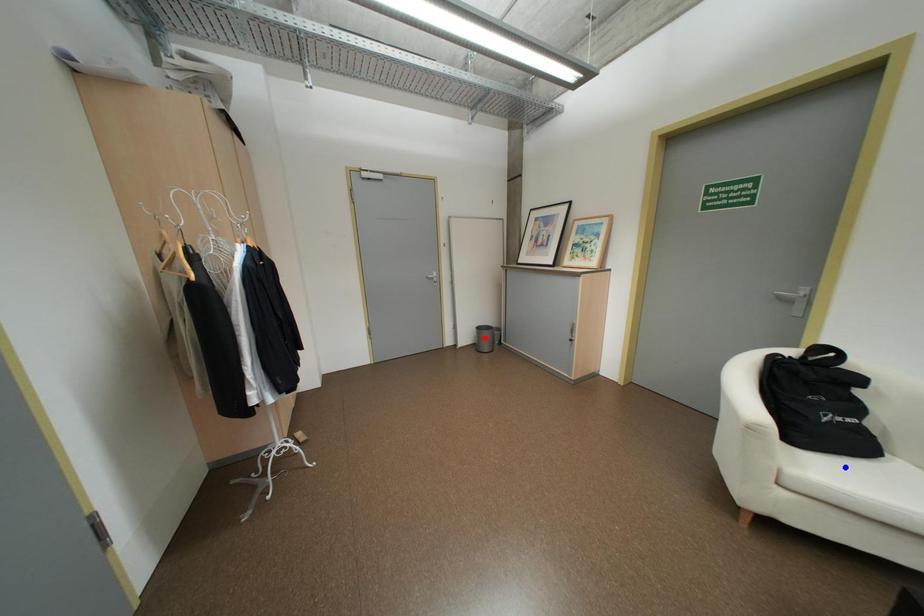
Question: Two points are marked on the image. Which point is closer to the camera?

Choices:
 (A) Blue point is closer.
 (B) Red point is closer.

Answer: (A)